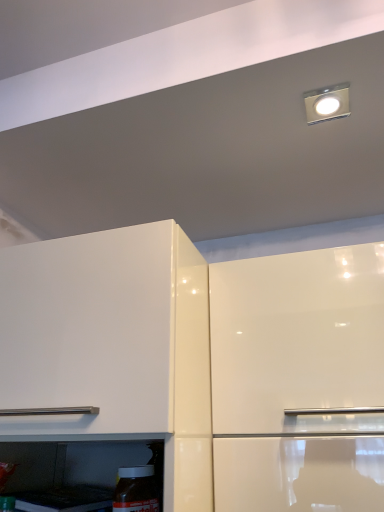
You are a GUI agent. You are given a task and a screenshot of the screen. Output one action in this format:
    pyautogui.click(x=<x>, y=<y>)
    Task: Click on the matte silver light fixture at upper right
    
    Given the screenshot: What is the action you would take?
    pyautogui.click(x=327, y=103)

What do you see at coordinates (327, 103) in the screenshot? I see `matte silver light fixture at upper right` at bounding box center [327, 103].

Where is `matte silver light fixture at upper right`? matte silver light fixture at upper right is located at coordinates (327, 103).